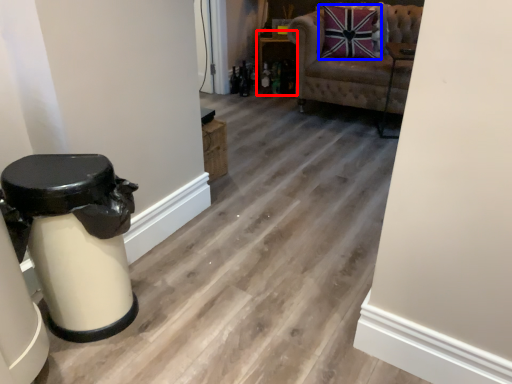
Question: Which object is further to the camera taking this photo, furniture (highlighted by a red box) or pillow (highlighted by a blue box)?

Choices:
 (A) furniture
 (B) pillow

Answer: (A)